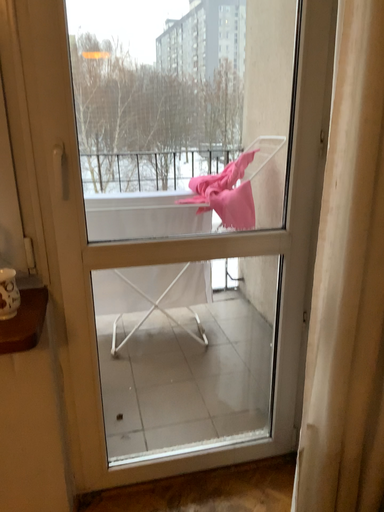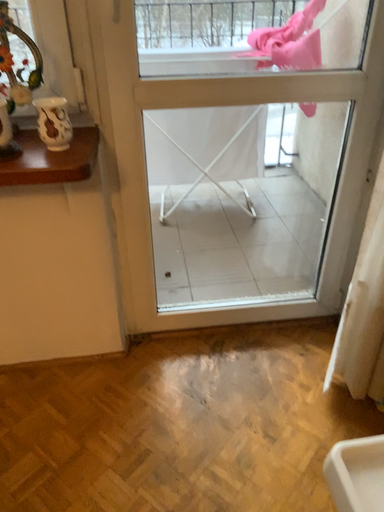
Question: Which way did the camera rotate in the video?

Choices:
 (A) rotated left
 (B) rotated right

Answer: (A)